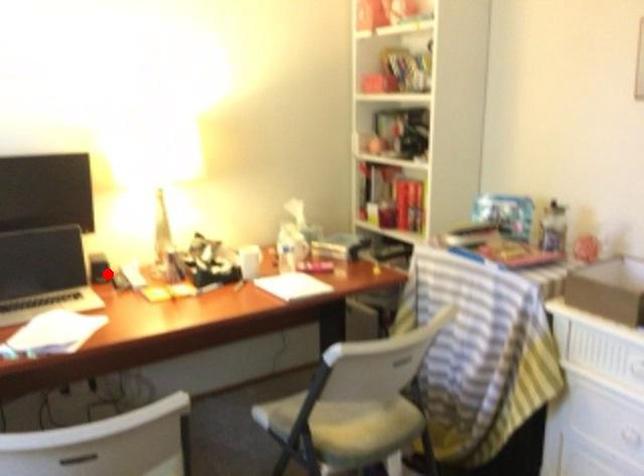
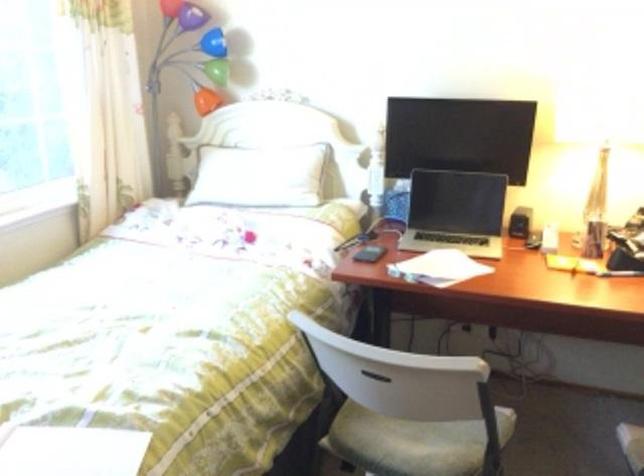
Where in the second image is the point corresponding to the highlighted location from the first image?

(518, 222)